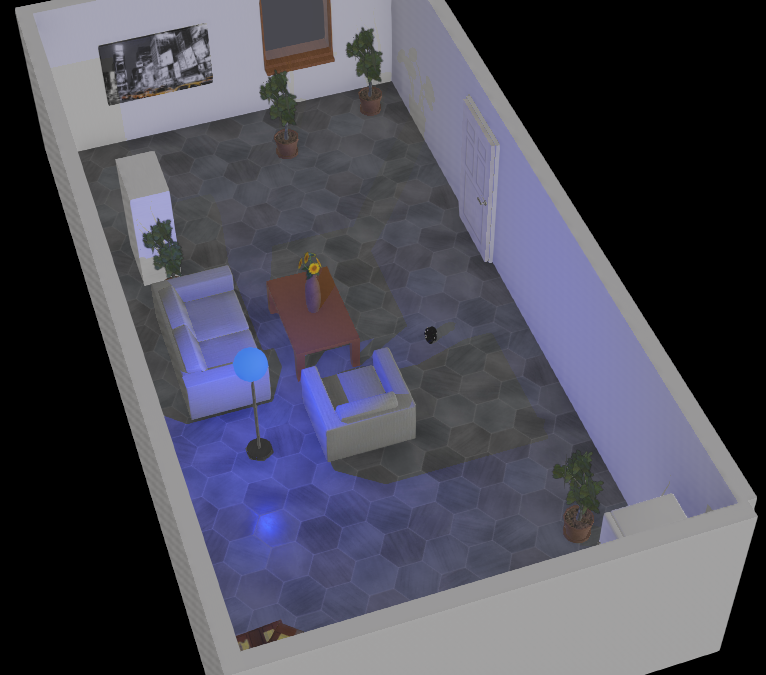
Locate an element on the screen. This screenshot has height=675, width=766. window is located at coordinates (295, 20).